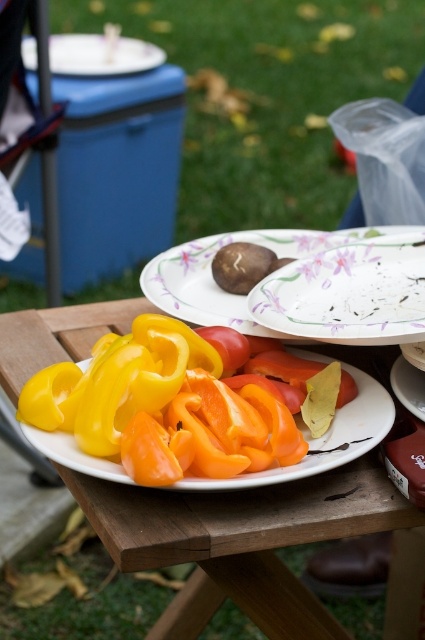
Question: Does smooth plastic plate at center lie behind brown matte mushroom at center?

Choices:
 (A) yes
 (B) no

Answer: (B)

Question: Does wooden picnic table at center have a larger size compared to smooth plastic plate at center?

Choices:
 (A) yes
 (B) no

Answer: (A)

Question: Which point appears closest to the camera in this image?

Choices:
 (A) (257, 284)
 (B) (221, 273)

Answer: (A)

Question: Among these objects, which one is nearest to the camera?

Choices:
 (A) wooden picnic table at center
 (B) sliced yellow bell peppers at center
 (C) brown matte mushroom at center
 (D) smooth plastic plate at center

Answer: (A)

Question: Which of the following is the farthest from the observer?

Choices:
 (A) smooth plastic plate at center
 (B) white matte plate at upper left
 (C) brown matte mushroom at center

Answer: (B)

Question: Is smooth plastic plate at center behind sliced yellow bell peppers at center?

Choices:
 (A) no
 (B) yes

Answer: (B)